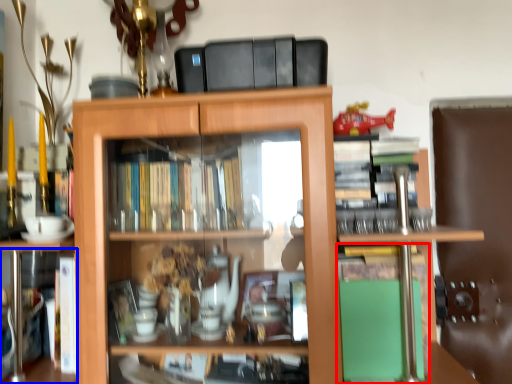
Question: Which object is further to the camera taking this photo, book (highlighted by a red box) or book (highlighted by a blue box)?

Choices:
 (A) book
 (B) book

Answer: (A)